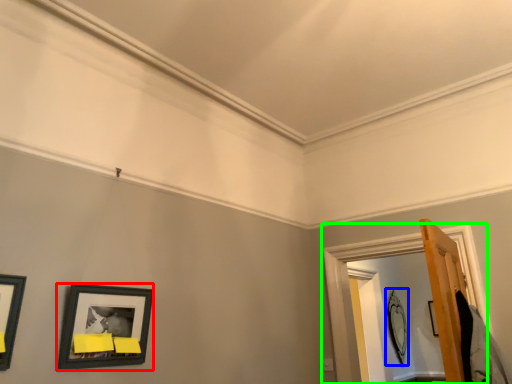
Question: Which object is positioned closest to picture frame (highlighted by a red box)? Select from picture frame (highlighted by a blue box) and window frame (highlighted by a green box).

Choices:
 (A) picture frame
 (B) window frame

Answer: (B)